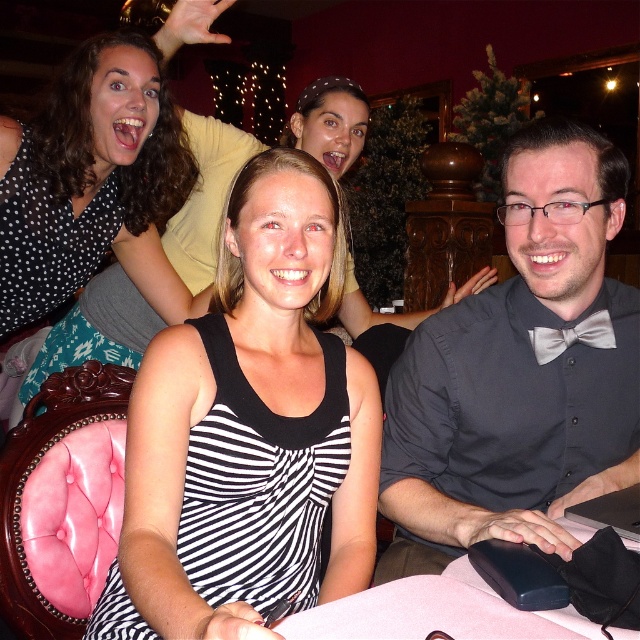
Question: Which object is closer to the camera taking this photo?

Choices:
 (A) polka dot blouse at upper left
 (B) black striped dress at center

Answer: (B)

Question: Is black striped dress at center to the left of silvery satin bow tie at right from the viewer's perspective?

Choices:
 (A) no
 (B) yes

Answer: (B)

Question: Among these objects, which one is nearest to the camera?

Choices:
 (A) black striped dress at center
 (B) silvery satin bow tie at right
 (C) polka dot blouse at upper left

Answer: (A)

Question: Can you confirm if black striped dress at center is thinner than polka dot blouse at upper left?

Choices:
 (A) no
 (B) yes

Answer: (A)

Question: Which point appears farthest from the camera in this image?

Choices:
 (A) (563, 342)
 (B) (490, 483)

Answer: (B)

Question: Can you confirm if polka dot blouse at upper left is positioned to the right of silvery satin bow tie at right?

Choices:
 (A) no
 (B) yes

Answer: (A)